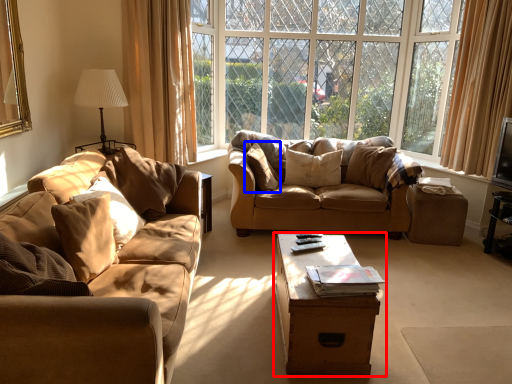
Question: Which object appears closest to the camera in this image, table (highlighted by a red box) or pillow (highlighted by a blue box)?

Choices:
 (A) table
 (B) pillow

Answer: (A)